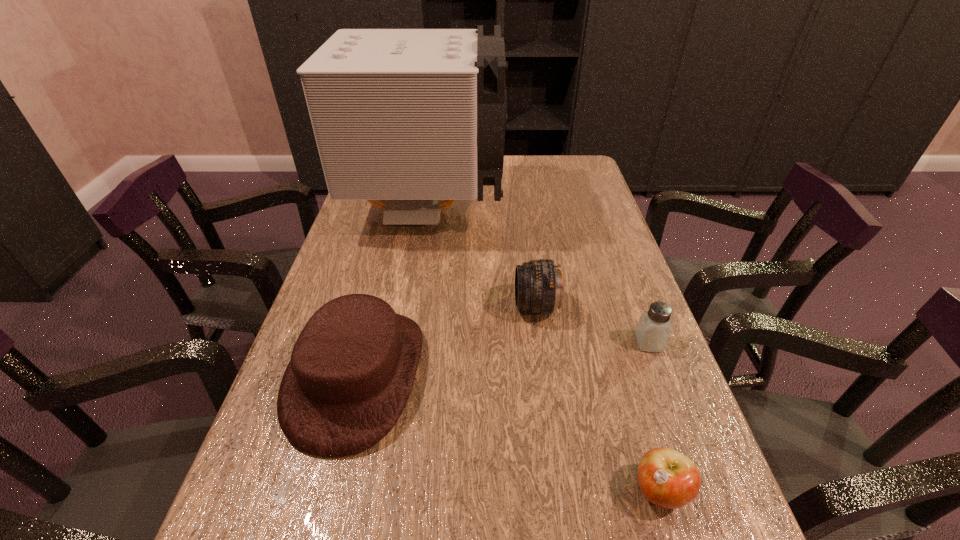
Locate an element on the screen. The image size is (960, 540). free space located at the front element of the third object from left to right is located at coordinates (434, 306).

What are the coordinates of `vacant region located at the front element of the third object from left to right` in the screenshot? It's located at (357, 306).

Find the location of a particular element. blank space located 0.070m on the front of the saltshaker is located at coordinates (663, 381).

The height and width of the screenshot is (540, 960). I want to click on blank space located on the back of the shortest object, so click(622, 364).

The height and width of the screenshot is (540, 960). Identify the location of object situated at the far edge. (413, 116).

Identify the location of fan located in the left edge section of the desktop. This screenshot has height=540, width=960. (413, 116).

Identify the location of hat present at the left edge. The image size is (960, 540). (352, 368).

Locate an element on the screen. The width and height of the screenshot is (960, 540). saltshaker situated at the right edge is located at coordinates (653, 330).

This screenshot has height=540, width=960. In order to click on apple that is positioned at the right edge in this screenshot , I will do `click(667, 478)`.

Identify the location of object that is at the far left corner. This screenshot has width=960, height=540. (413, 116).